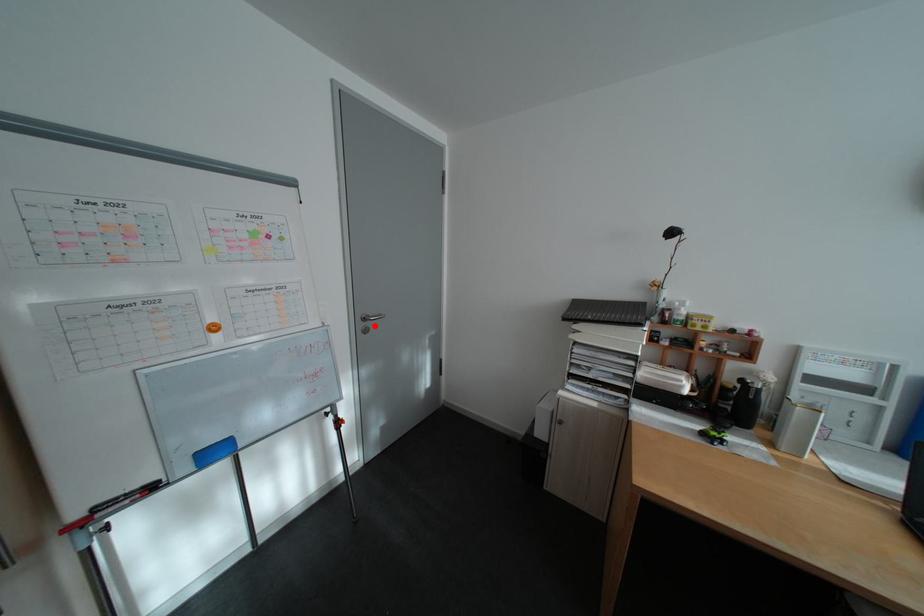
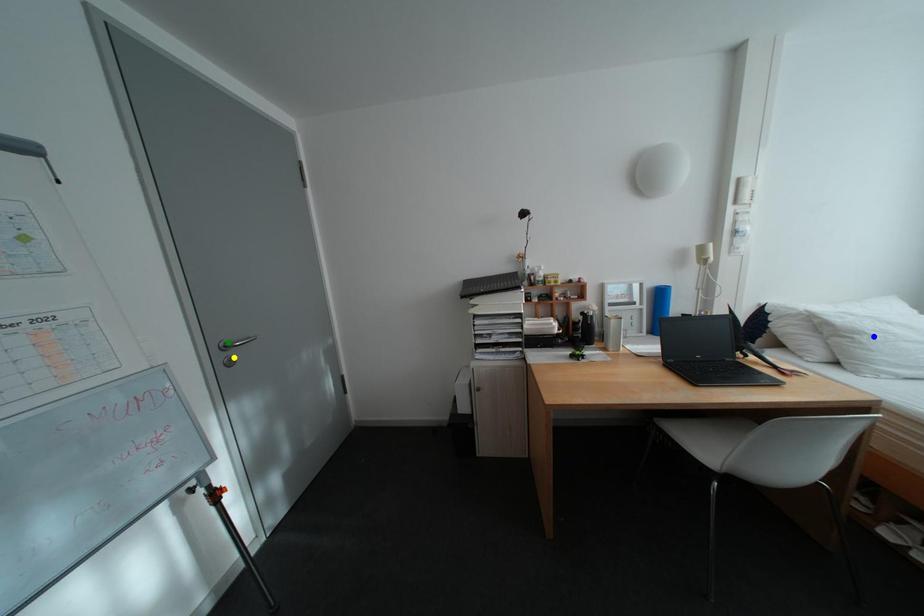
Question: I am providing you with two images of the same scene from different viewpoints. A red point is marked on the first image. You are given multiple points on the second image. In image 2, which mark is for the same physical point as the one in image 1?

Choices:
 (A) yellow point
 (B) green point
 (C) blue point

Answer: (A)